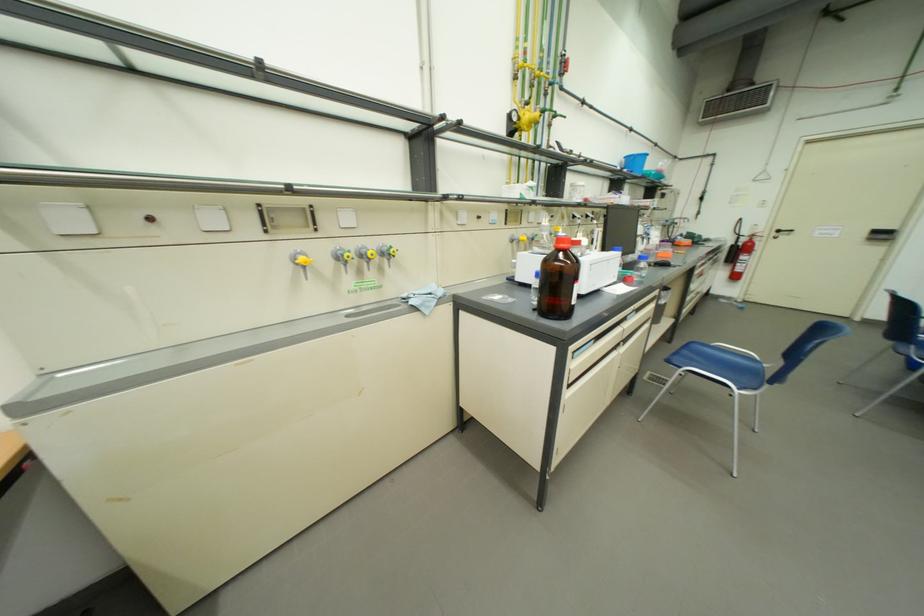
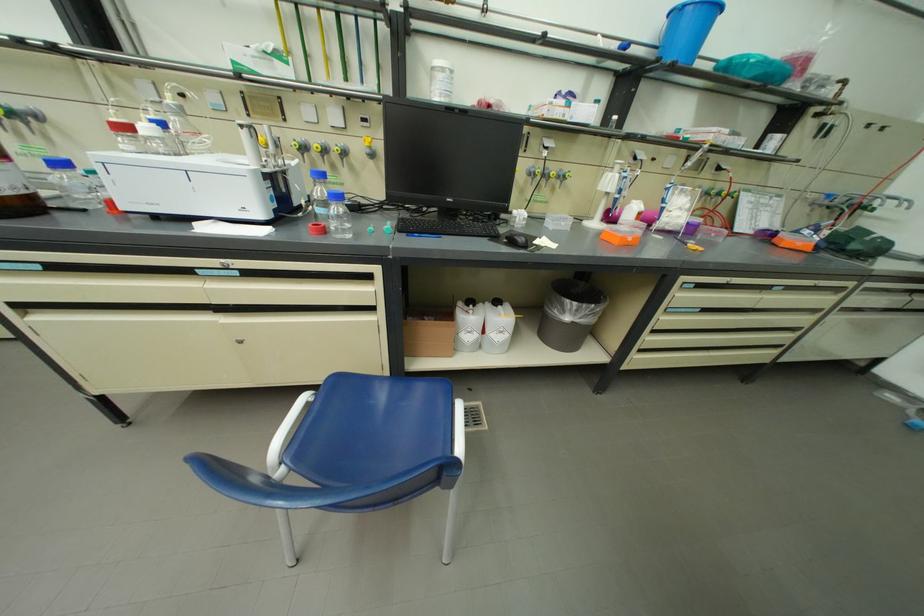
Locate, in the second image, the point that corresponds to [634,159] in the first image.

(677, 20)